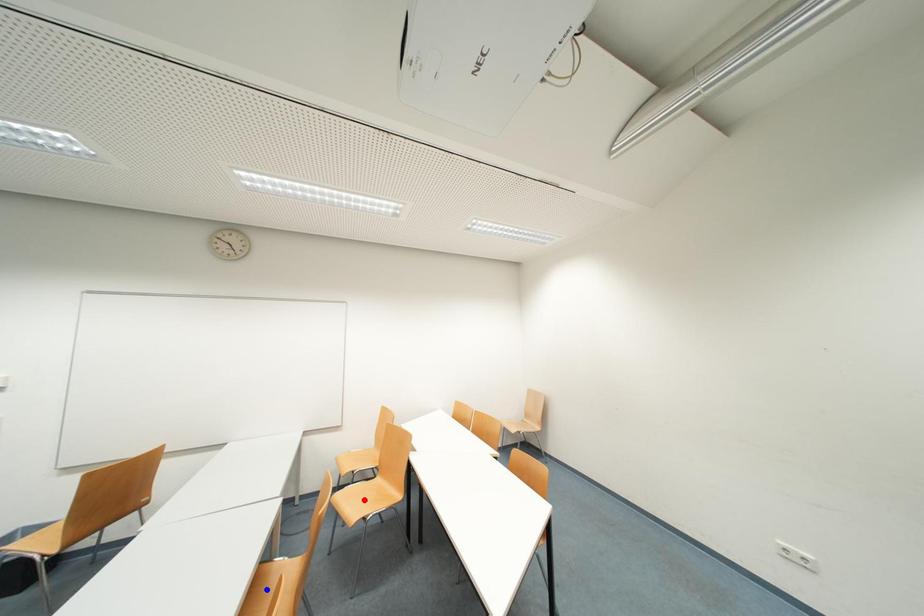
Question: Which of the two points in the image is closer to the camera?

Choices:
 (A) Blue point is closer.
 (B) Red point is closer.

Answer: (A)